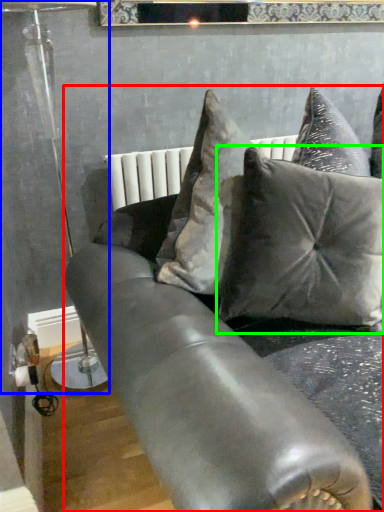
Question: Which object is positioned farthest from studio couch (highlighted by a red box)? Select from lamp (highlighted by a blue box) and pillow (highlighted by a green box).

Choices:
 (A) lamp
 (B) pillow

Answer: (A)